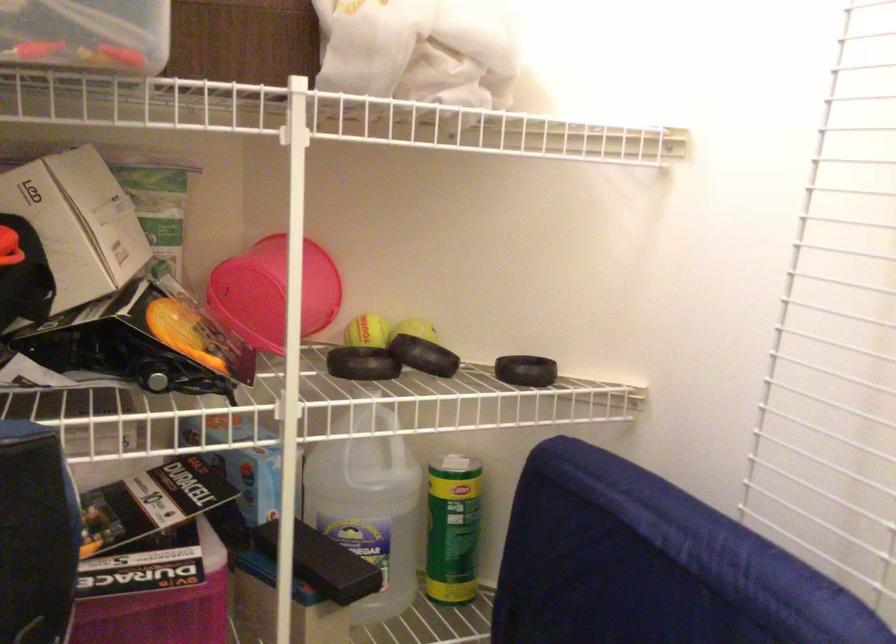
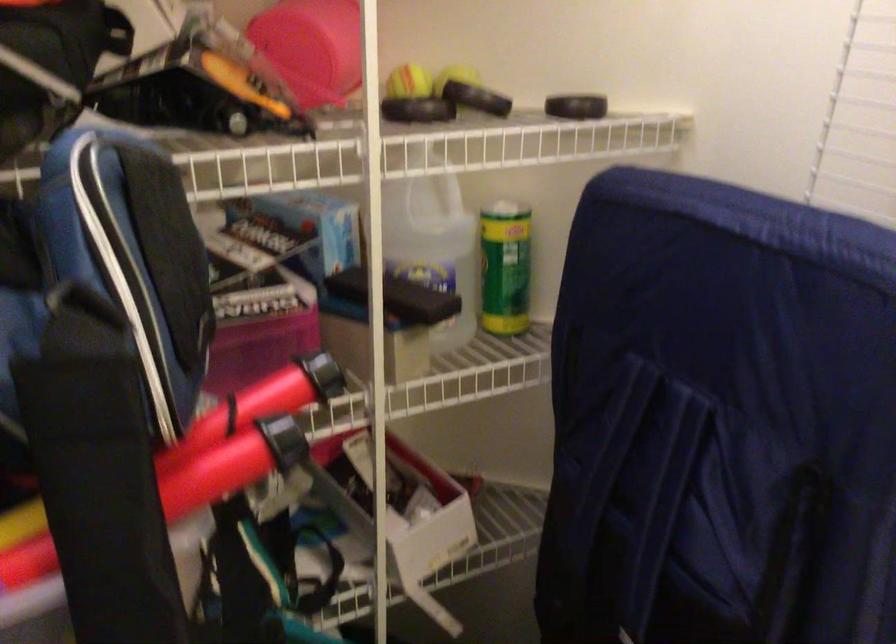
The point at (409, 333) is marked in the first image. Where is the corresponding point in the second image?

(457, 76)